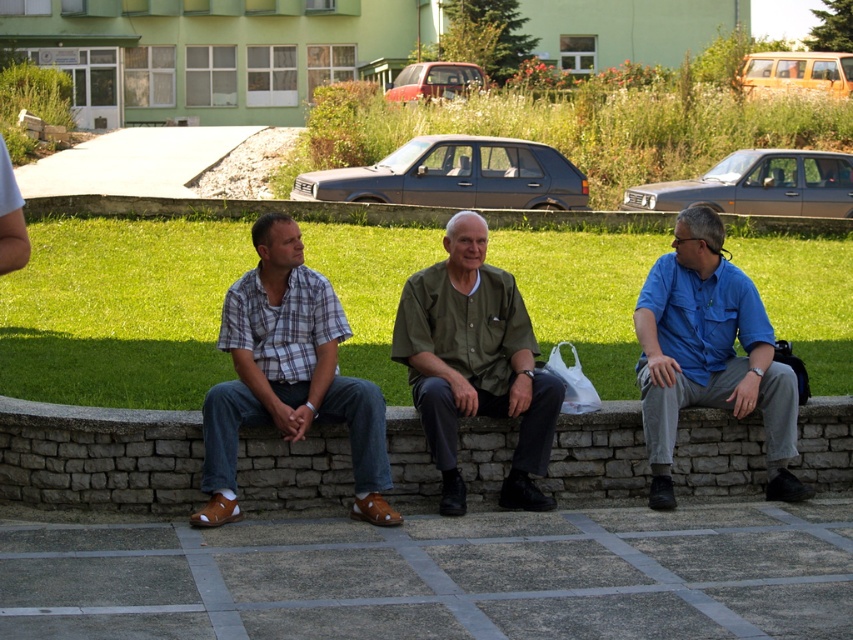
Does stone bench at center appear on the right side of blue cotton shirt at right?

No, stone bench at center is not to the right of blue cotton shirt at right.

Between point (399, 502) and point (793, 486), which one is positioned behind?

The point (793, 486) is behind.

This screenshot has height=640, width=853. Identify the location of stone bench at center. (99, 456).

Can you confirm if plaid cotton shirt at center is positioned to the left of green matte shirt at center?

Correct, you'll find plaid cotton shirt at center to the left of green matte shirt at center.

Who is positioned more to the right, plaid cotton shirt at center or green matte shirt at center?

From the viewer's perspective, green matte shirt at center appears more on the right side.

What do you see at coordinates (288, 376) in the screenshot?
I see `plaid cotton shirt at center` at bounding box center [288, 376].

Where is `plaid cotton shirt at center`? This screenshot has height=640, width=853. plaid cotton shirt at center is located at coordinates (288, 376).

Who is taller, stone bench at center or green matte shirt at center?

With more height is green matte shirt at center.

Measure the distance between stone bench at center and green matte shirt at center.

A distance of 1.80 meters exists between stone bench at center and green matte shirt at center.

You are a GUI agent. You are given a task and a screenshot of the screen. Output one action in this format:
    pyautogui.click(x=<x>, y=<y>)
    Task: Click on the stone bench at center
    The width and height of the screenshot is (853, 640).
    Given the screenshot: What is the action you would take?
    point(99,456)

Identify the location of stone bench at center. The height and width of the screenshot is (640, 853). (99, 456).